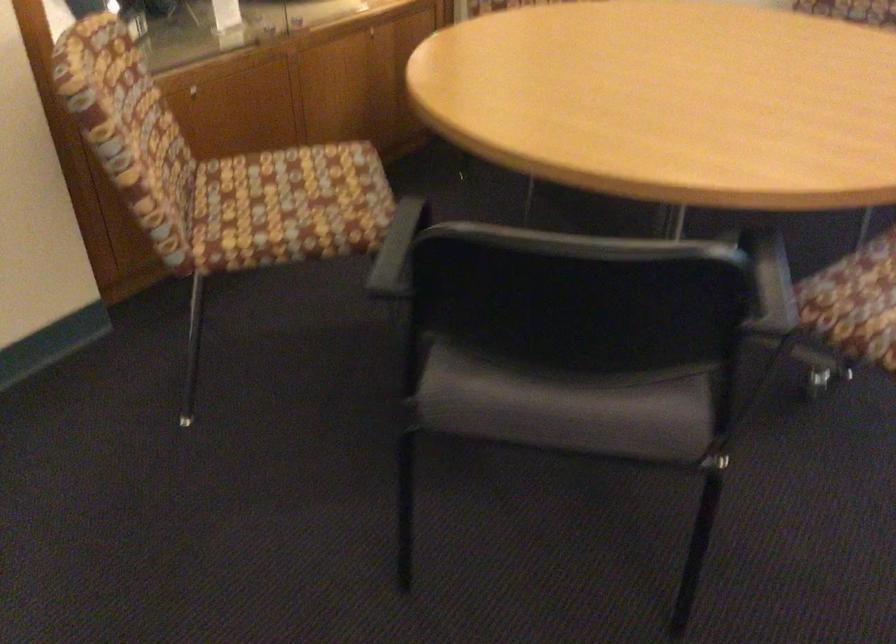
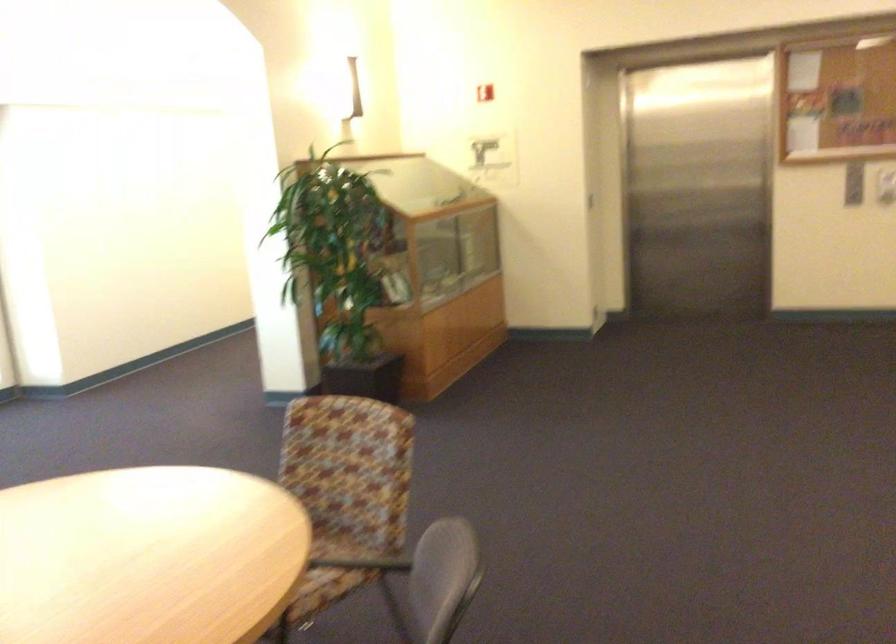
Find the pixel in the second image that matches (x=625, y=279) in the first image.

(435, 583)